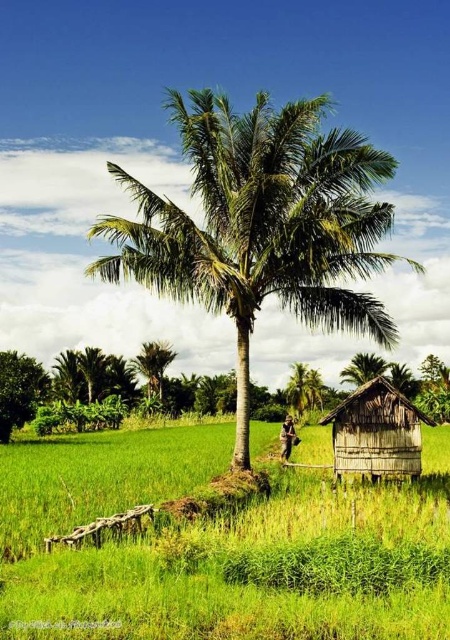
Between point (340, 218) and point (374, 424), which one is positioned behind?

Positioned behind is point (374, 424).

Is green leafy coconut tree at center wider than wooden hut at lower right?

Yes, green leafy coconut tree at center is wider than wooden hut at lower right.

Who is more distant from viewer, [280,186] or [363,394]?

The point [363,394] is behind.

Where is `green leafy coconut tree at center`? The image size is (450, 640). green leafy coconut tree at center is located at coordinates (261, 225).

Between green grassy rice field at lower left and green leafy coconut tree at center, which one has more height?

With more height is green leafy coconut tree at center.

Does point (217, 442) lie behind point (296, 125)?

Yes, point (217, 442) is behind point (296, 125).

The height and width of the screenshot is (640, 450). I want to click on green grassy rice field at lower left, so click(192, 540).

Between wooden hut at lower right and green leafy tree at lower left, which one has less height?

wooden hut at lower right

Is wooden hut at lower right positioned in front of green leafy tree at lower left?

That is True.

Find the location of a particular element. The image size is (450, 640). wooden hut at lower right is located at coordinates 377,433.